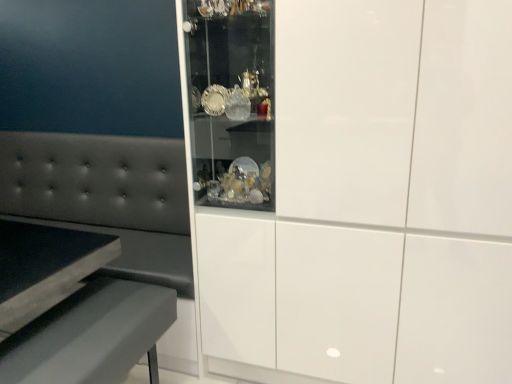
Question: From the image's perspective, is matte gray table at lower left located above or below tufted leather couch at left?

Choices:
 (A) above
 (B) below

Answer: (B)

Question: From a real-world perspective, is matte gray table at lower left positioned above or below tufted leather couch at left?

Choices:
 (A) above
 (B) below

Answer: (B)

Question: Based on their relative distances, which object is farther from the tufted leather couch at left?

Choices:
 (A) matte gray table at lower left
 (B) white glossy cabinet at center

Answer: (B)

Question: Estimate the real-world distances between objects in this image. Which object is farther from the tufted leather couch at left?

Choices:
 (A) white glossy cabinet at center
 (B) matte gray table at lower left

Answer: (A)